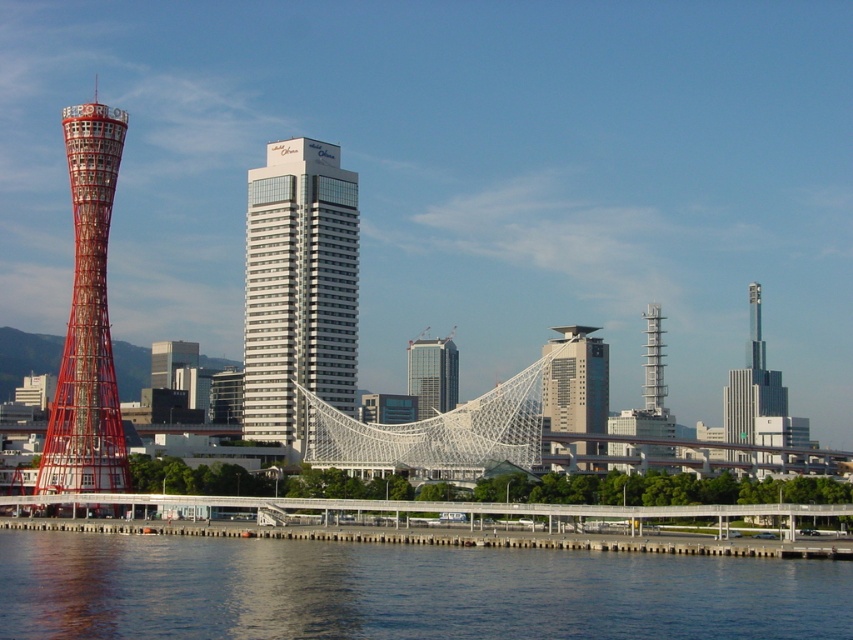
Is metallic gray bridge at lower center closer to camera compared to matte glass skyscraper at center?

Yes, it is.

Is metallic gray bridge at lower center below matte glass skyscraper at center?

Correct, metallic gray bridge at lower center is located below matte glass skyscraper at center.

Is point (755, 513) farther from viewer compared to point (566, 330)?

No, it is not.

The height and width of the screenshot is (640, 853). I want to click on metallic gray bridge at lower center, so click(434, 522).

Between white glass building at center and metallic gray bridge at lower center, which one has less height?

Standing shorter between the two is metallic gray bridge at lower center.

Where is `white glass building at center`? The width and height of the screenshot is (853, 640). white glass building at center is located at coordinates (299, 289).

Does metallic gray bridge at lower center have a greater height compared to silver metallic skyscraper at right?

No.

Is point (654, 528) behind point (744, 376)?

No, (654, 528) is closer to viewer.

The height and width of the screenshot is (640, 853). Find the location of `metallic gray bridge at lower center`. metallic gray bridge at lower center is located at coordinates (434, 522).